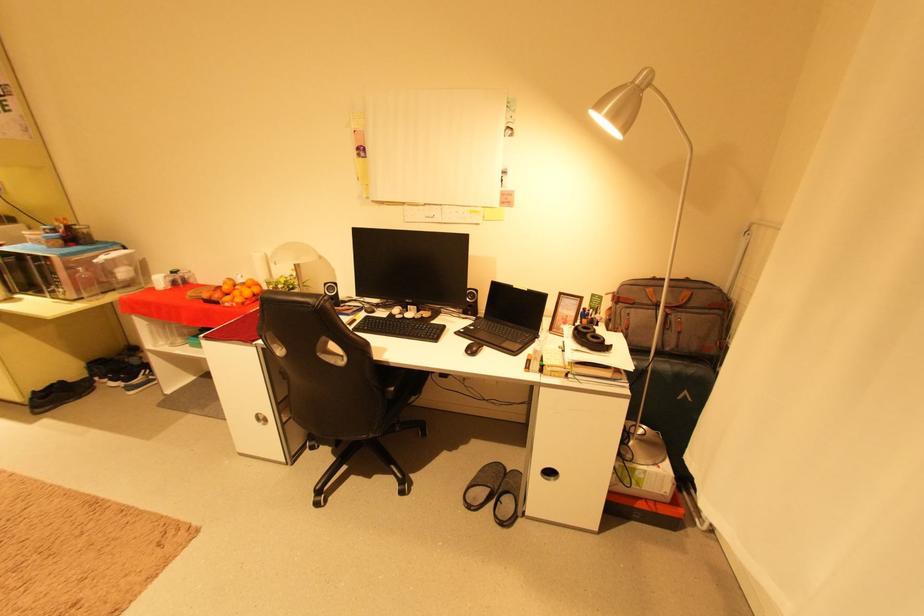
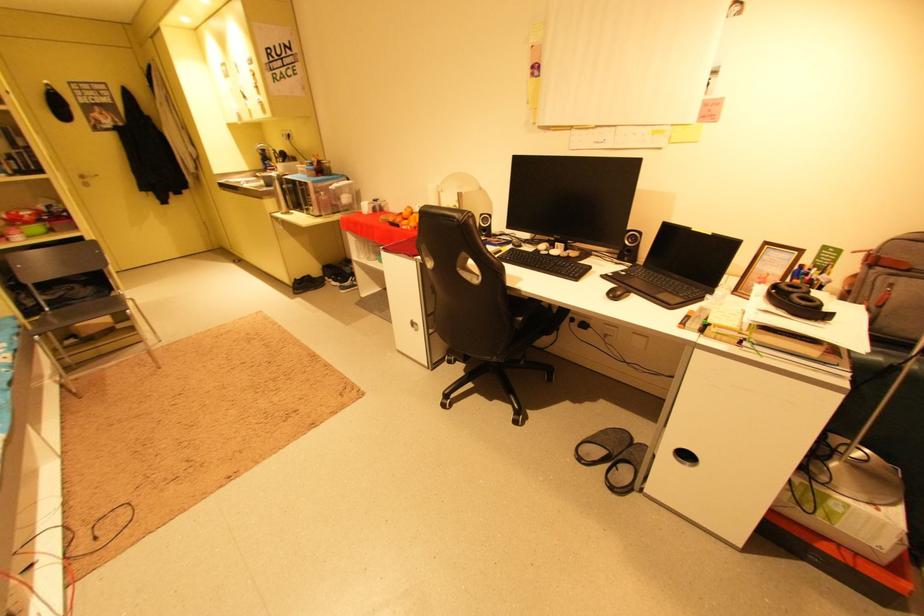
Question: Based on the continuous images, in which direction is the camera rotating? Reply with the corresponding letter.

Choices:
 (A) Left
 (B) Right
 (C) Up
 (D) Down

Answer: (A)